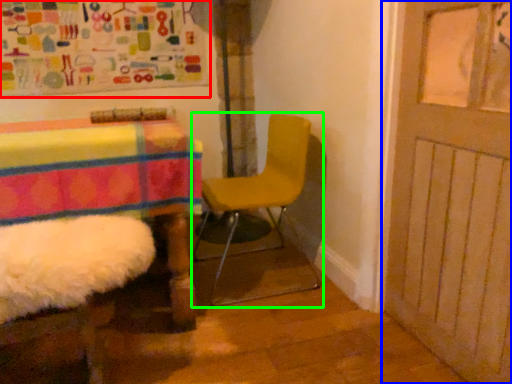
Question: Estimate the real-world distances between objects in this image. Which object is closer to bulletin board (highlighted by a red box), door (highlighted by a blue box) or chair (highlighted by a green box)?

Choices:
 (A) door
 (B) chair

Answer: (B)